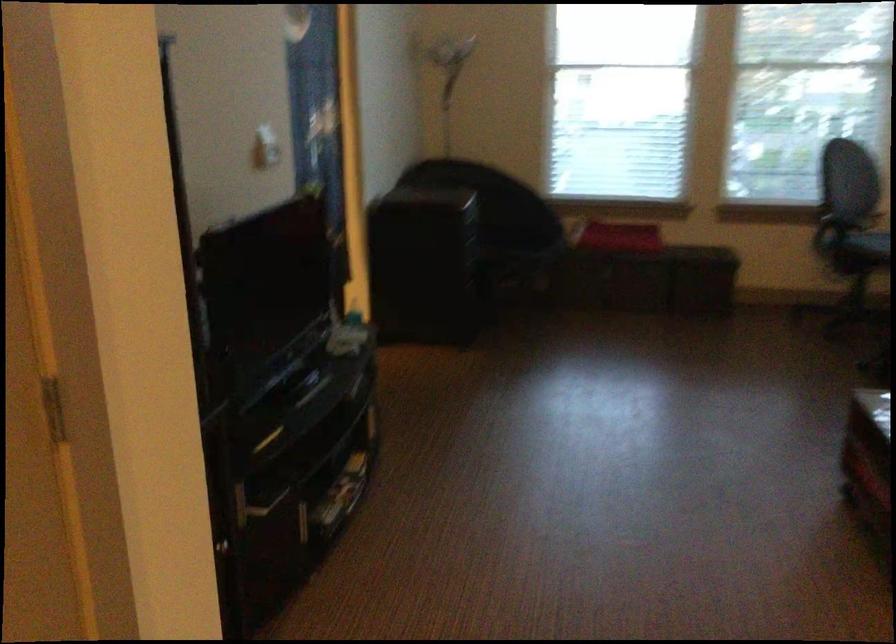
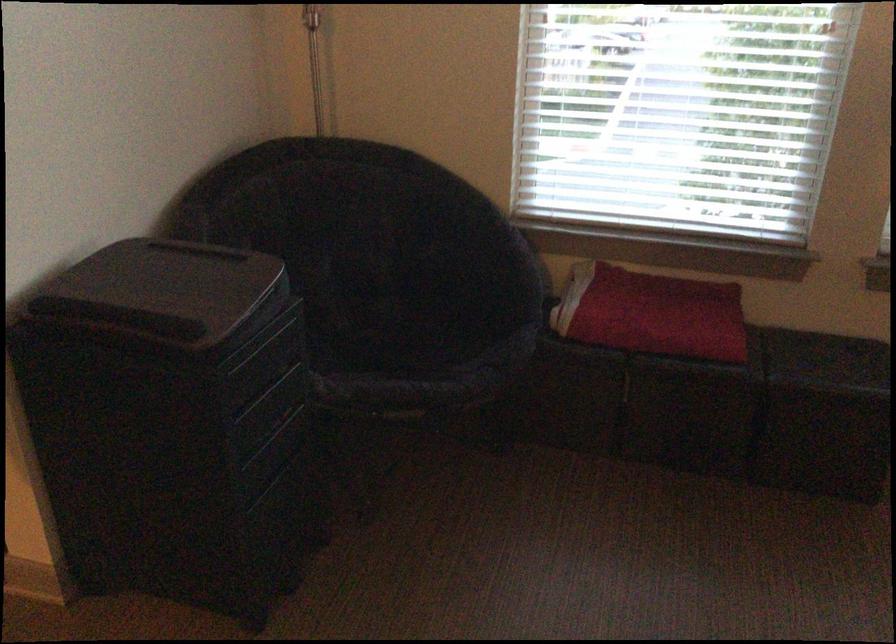
The point at (625, 229) is marked in the first image. Where is the corresponding point in the second image?

(651, 313)